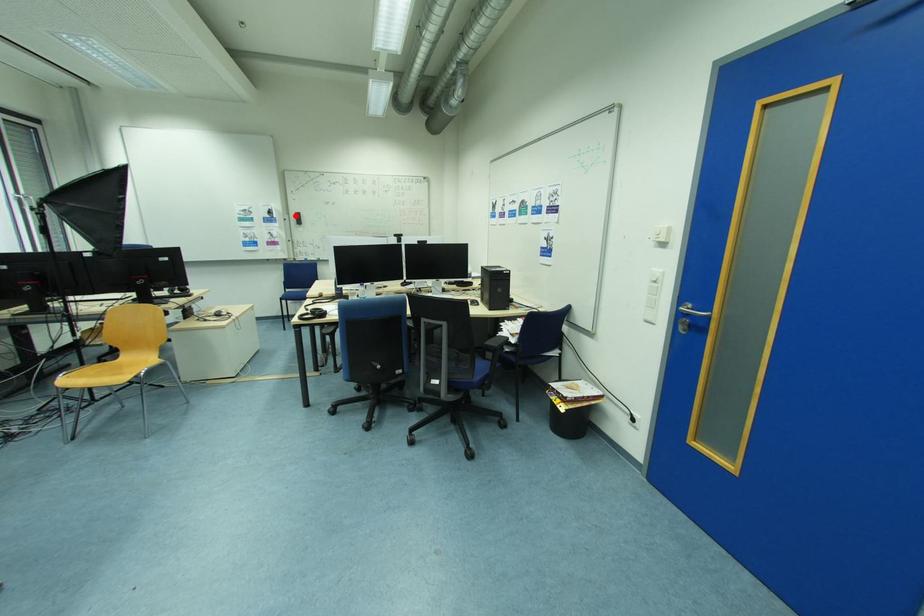
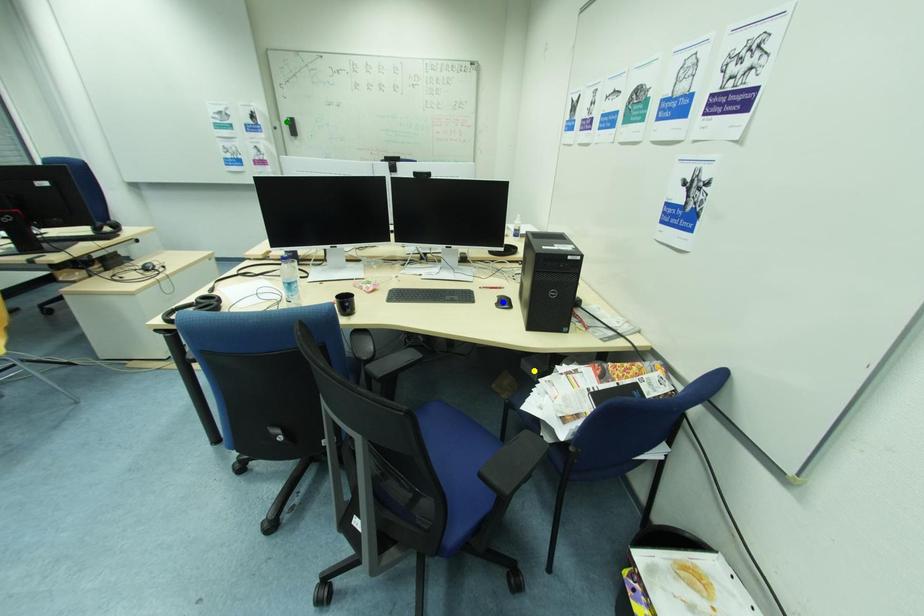
Question: I am providing you with two images of the same scene from different viewpoints. A red point is marked on the first image. You are given multiple points on the second image. Which mark in image 2 goes with the point in image 1?

Choices:
 (A) green point
 (B) yellow point
 (C) blue point

Answer: (A)